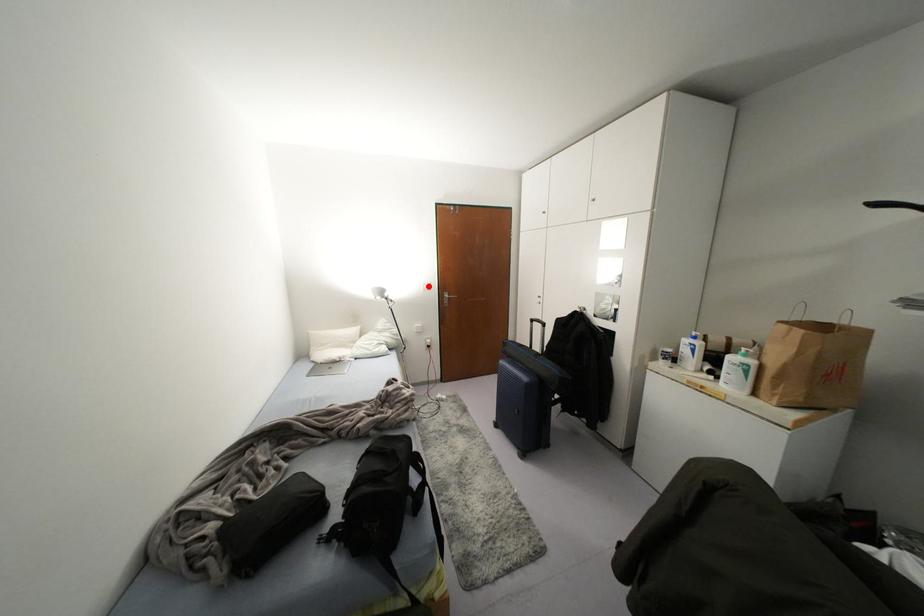
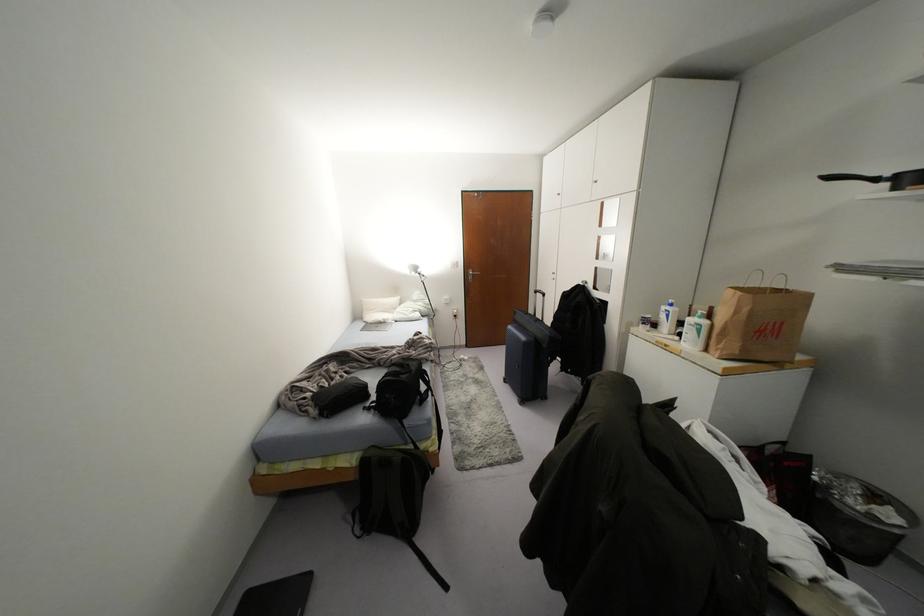
Where in the second image is the point corresponding to the highlighted location from the first image?

(456, 264)